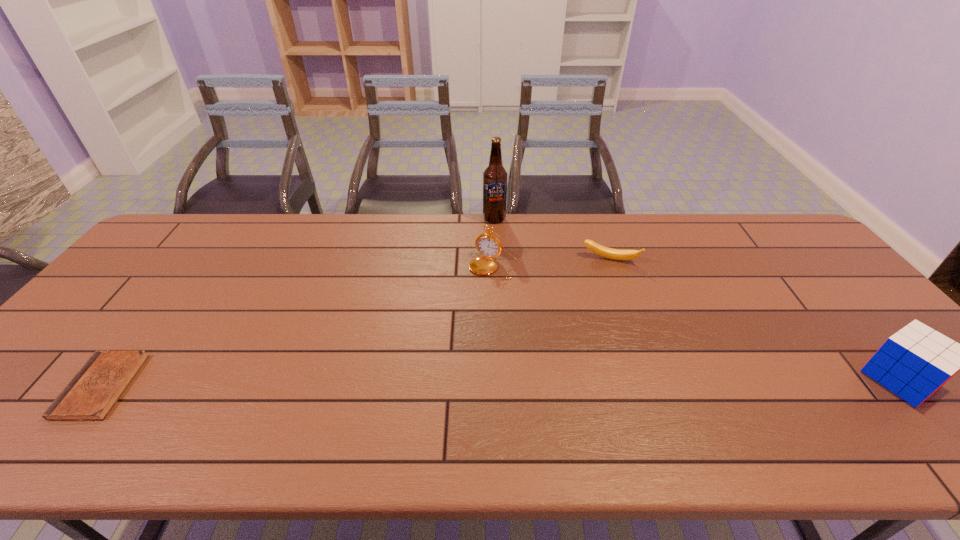
Find the location of a particular element. This screenshot has height=540, width=960. vacant space on the desktop that is between the diary and the rightmost object and is positioned on the face of the pocket watch is located at coordinates (426, 383).

At what (x,y) coordinates should I click in order to perform the action: click on free space on the desktop that is between the shortest object and the cube and is positioned on the label of the beer bottle. Please return your answer as a coordinate pair (x, y). Looking at the image, I should click on (468, 383).

At what (x,y) coordinates should I click in order to perform the action: click on free spot on the desktop that is between the diary and the rightmost object and is positioned at the stem of the fourth object from left to right. Please return your answer as a coordinate pair (x, y). The width and height of the screenshot is (960, 540). Looking at the image, I should click on (611, 381).